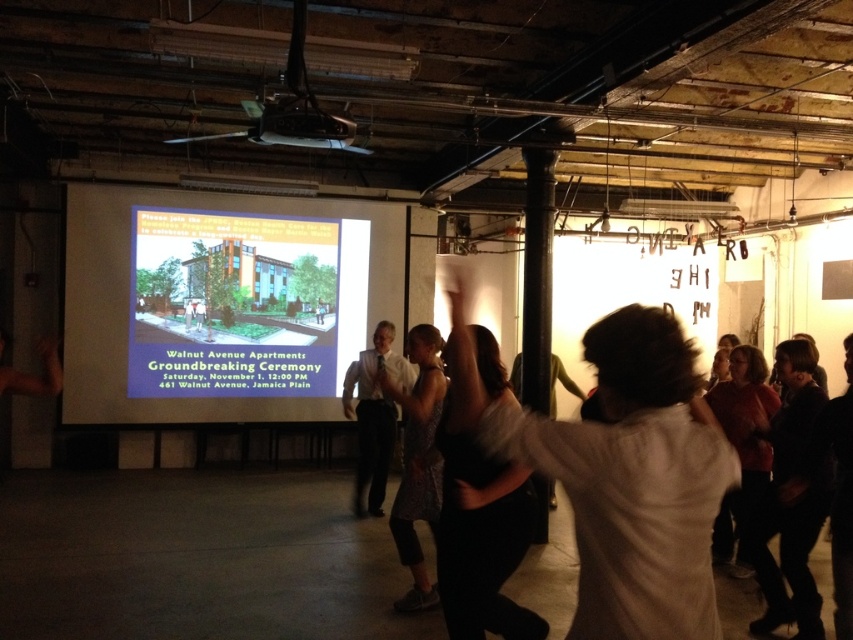
You are organizing a small presentation in this space and need to ensure that the printed fabric dress at center is visible to all attendees. Given that the matte white projector screen at center is currently blocking the view, can you suggest a way to adjust the setup so that both the projector screen and the dress are visible?

The matte white projector screen at center is above the printed fabric dress at center. To make both visible, lower the projector screen or move the dress to a position where it doesn not obstruct the screen, ensuring attendees can see both elements.

Based on the photo, you are standing at the point labeled as point (231, 305) in the image. What is the color of the surface you are currently touching?

The point (231, 305) is on matte green building at center, so the surface you are touching is matte green.